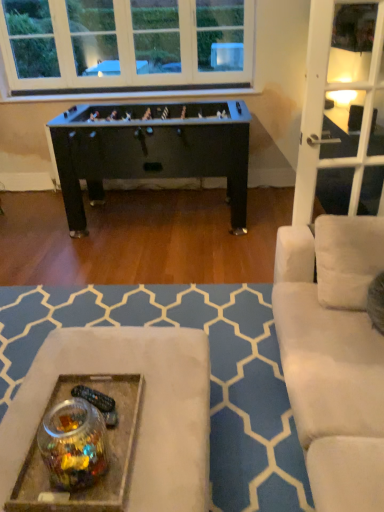
Question: Do you think metallic tray at lower center is within translucent glass jar at lower left, or outside of it?

Choices:
 (A) inside
 (B) outside

Answer: (B)

Question: Would you say metallic tray at lower center is to the left or to the right of translucent glass jar at lower left in the picture?

Choices:
 (A) left
 (B) right

Answer: (A)

Question: Based on their sizes in the image, would you say metallic tray at lower center is bigger or smaller than translucent glass jar at lower left?

Choices:
 (A) small
 (B) big

Answer: (A)

Question: From the image's perspective, is translucent glass jar at lower left located above or below metallic tray at lower center?

Choices:
 (A) above
 (B) below

Answer: (A)

Question: In the image, is translucent glass jar at lower left positioned in front of or behind metallic tray at lower center?

Choices:
 (A) behind
 (B) front

Answer: (B)

Question: Is point (97, 460) positioned closer to the camera than point (122, 355)?

Choices:
 (A) closer
 (B) farther

Answer: (A)

Question: Is translucent glass jar at lower left taller or shorter than metallic tray at lower center?

Choices:
 (A) short
 (B) tall

Answer: (B)